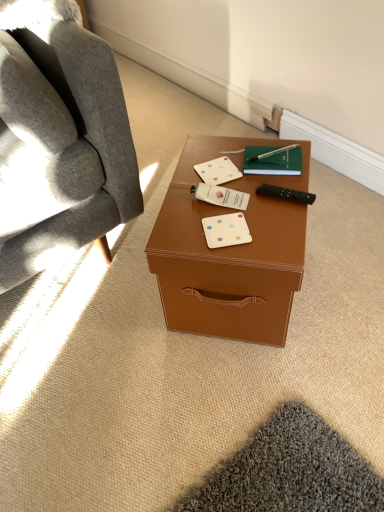
Image resolution: width=384 pixels, height=512 pixels. I want to click on empty space that is ontop of brown leather desk at center, so click(x=232, y=193).